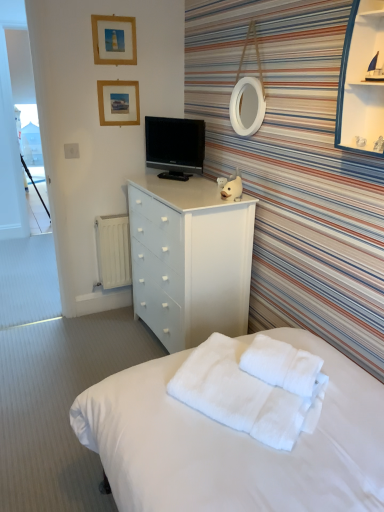
In order to face transparent glass cabinet at upper right, should I rotate leftwards or rightwards?

It's best to rotate right around 24.216 degrees.

In order to face black glossy tv at center, should I rotate leftwards or rightwards?

Rotate left and turn 2.100 degrees.

The height and width of the screenshot is (512, 384). What do you see at coordinates (243, 395) in the screenshot?
I see `white fluffy blanket at lower center` at bounding box center [243, 395].

Where is `matte wooden picture frame at upper left, arranged as the second picture frame when ordered from the bottom`? This screenshot has width=384, height=512. matte wooden picture frame at upper left, arranged as the second picture frame when ordered from the bottom is located at coordinates (114, 40).

What do you see at coordinates (114, 40) in the screenshot?
I see `matte wooden picture frame at upper left, arranged as the second picture frame when ordered from the bottom` at bounding box center [114, 40].

Locate an element on the screen. white soft towel at lower center is located at coordinates (281, 365).

At what (x,y) coordinates should I click in order to perform the action: click on cabinet located in front of the matte wooden picture frame at upper left, which is the 1th picture frame in top-to-bottom order. Please return your answer as a coordinate pair (x, y). Looking at the image, I should click on (362, 81).

From a real-world perspective, which is physically below, matte wooden picture frame at upper left, arranged as the second picture frame when ordered from the bottom, or transparent glass cabinet at upper right?

From a 3D spatial view, transparent glass cabinet at upper right is below.

Is point (122, 50) positioned before point (368, 86)?

No, (122, 50) is further to viewer.

Looking at this image, how different are the orientations of matte wooden picture frame at upper left, arranged as the second picture frame when ordered from the bottom, and transparent glass cabinet at upper right in degrees?

89.6 degrees separate the facing orientations of matte wooden picture frame at upper left, arranged as the second picture frame when ordered from the bottom, and transparent glass cabinet at upper right.

Does point (302, 395) appear closer or farther from the camera than point (150, 296)?

Point (302, 395) is closer to the camera than point (150, 296).

From the image's perspective, is white soft towel at lower center under white matte chest of drawers at center?

Yes.

Does white soft towel at lower center have a smaller size compared to white matte chest of drawers at center?

Yes.

Based on the photo, how different are the orientations of transparent glass cabinet at upper right and white fluffy blanket at lower center in degrees?

There is a 34.8-degree angle between the facing directions of transparent glass cabinet at upper right and white fluffy blanket at lower center.

Does transparent glass cabinet at upper right have a lesser width compared to white fluffy blanket at lower center?

Indeed, transparent glass cabinet at upper right has a lesser width compared to white fluffy blanket at lower center.

From a real-world perspective, does transparent glass cabinet at upper right stand above white fluffy blanket at lower center?

Yes.

Locate an element on the screen. The height and width of the screenshot is (512, 384). blanket located below the transparent glass cabinet at upper right (from the image's perspective) is located at coordinates (243, 395).

Considering the sizes of objects black glossy tv at center and transparent glass cabinet at upper right in the image provided, who is bigger, black glossy tv at center or transparent glass cabinet at upper right?

transparent glass cabinet at upper right.

What's the angular difference between black glossy tv at center and transparent glass cabinet at upper right's facing directions?

39.1 degrees separate the facing orientations of black glossy tv at center and transparent glass cabinet at upper right.

Which point is more forward, [151,166] or [378,17]?

The point [378,17] is closer.

Is the depth of black glossy tv at center greater than that of transparent glass cabinet at upper right?

Yes.

Is transparent glass cabinet at upper right behind white soft towel at lower center?

No, it is not.

Does point (359, 79) appear closer or farther from the camera than point (291, 384)?

Point (359, 79).

Is white soft towel at lower center at the back of transparent glass cabinet at upper right?

No, transparent glass cabinet at upper right's orientation is not away from white soft towel at lower center.

In the scene shown: From the image's perspective, relative to transparent glass cabinet at upper right, is white fluffy blanket at lower center above or below?

white fluffy blanket at lower center is below transparent glass cabinet at upper right.

Is white fluffy blanket at lower center positioned far away from transparent glass cabinet at upper right?

No, white fluffy blanket at lower center is not far from transparent glass cabinet at upper right.

Locate an element on the screen. Image resolution: width=384 pixels, height=512 pixels. cabinet lying on the right of white fluffy blanket at lower center is located at coordinates (362, 81).

Considering the sizes of objects white fluffy blanket at lower center and transparent glass cabinet at upper right in the image provided, who is taller, white fluffy blanket at lower center or transparent glass cabinet at upper right?

transparent glass cabinet at upper right is taller.

Is point (131, 37) closer or farther from the camera than point (109, 262)?

Point (131, 37) appears to be closer to the viewer than point (109, 262).

Would you say matte wooden picture frame at upper left, arranged as the second picture frame when ordered from the bottom, is to the left or to the right of white matte radiator at left in the picture?

In the image, matte wooden picture frame at upper left, arranged as the second picture frame when ordered from the bottom, appears on the right side of white matte radiator at left.

Can you tell me how much matte wooden picture frame at upper left, arranged as the second picture frame when ordered from the bottom, and white matte radiator at left differ in facing direction?

The angular difference between matte wooden picture frame at upper left, arranged as the second picture frame when ordered from the bottom, and white matte radiator at left is 0.786 degrees.

In order to click on cabinet in front of the matte wooden picture frame at upper left, which is the 1th picture frame in top-to-bottom order in this screenshot , I will do coord(362,81).

Image resolution: width=384 pixels, height=512 pixels. What are the coordinates of `the chest of drawers that is under the white soft towel at lower center (from a real-world perspective)` in the screenshot? It's located at (190, 259).

Which object lies further to the anchor point white matte radiator at left, matte wooden picture frame at upper left, which is the 1th picture frame in top-to-bottom order, or white fluffy blanket at lower center?

Based on the image, white fluffy blanket at lower center appears to be further to white matte radiator at left.

Considering their positions, is transparent glass cabinet at upper right positioned further to black glossy tv at center than white fluffy blanket at lower center?

white fluffy blanket at lower center lies further to black glossy tv at center than the other object.

Looking at this image, looking at the image, which one is located closer to white matte chest of drawers at center, white fluffy blanket at lower center or transparent glass cabinet at upper right?

white fluffy blanket at lower center is positioned closer to the anchor white matte chest of drawers at center.

From the image, which object appears to be farther from white soft towel at lower center, white matte radiator at left or matte wooden picture frame at upper left, which is the 1th picture frame in top-to-bottom order?

matte wooden picture frame at upper left, which is the 1th picture frame in top-to-bottom order.

Considering their positions, is matte wooden picture frame at upper left, arranged as the second picture frame when ordered from the bottom, positioned further to white fluffy blanket at lower center than white matte chest of drawers at center?

The object further to white fluffy blanket at lower center is matte wooden picture frame at upper left, arranged as the second picture frame when ordered from the bottom.

From the image, which object appears to be farther from matte wooden picture frame at upper left, arranged as the second picture frame when ordered from the bottom, white matte chest of drawers at center or white fluffy blanket at lower center?

Based on the image, white fluffy blanket at lower center appears to be further to matte wooden picture frame at upper left, arranged as the second picture frame when ordered from the bottom.

Looking at the image, which one is located further to white soft towel at lower center, matte wooden picture frame at upper left, which is the 1th picture frame in top-to-bottom order, or white matte chest of drawers at center?

matte wooden picture frame at upper left, which is the 1th picture frame in top-to-bottom order, is further to white soft towel at lower center.

In the scene shown: When comparing their distances from white fluffy blanket at lower center, does transparent glass cabinet at upper right or matte wooden picture frame at upper left, which is the 1th picture frame in top-to-bottom order, seem further?

Among the two, matte wooden picture frame at upper left, which is the 1th picture frame in top-to-bottom order, is located further to white fluffy blanket at lower center.

Image resolution: width=384 pixels, height=512 pixels. Identify the location of chest of drawers between white soft towel at lower center and white matte radiator at left from front to back. (190, 259).

The height and width of the screenshot is (512, 384). In order to click on chest of drawers between wooden picture frame at upper center, placed as the second picture frame when sorted from top to bottom, and white fluffy blanket at lower center, in the vertical direction in this screenshot , I will do `click(190, 259)`.

Find the location of a particular element. The width and height of the screenshot is (384, 512). television between white fluffy blanket at lower center and white matte radiator at left in the front-back direction is located at coordinates 175,146.

The height and width of the screenshot is (512, 384). I want to click on cabinet between matte wooden picture frame at upper left, arranged as the second picture frame when ordered from the bottom, and white soft towel at lower center vertically, so click(362, 81).